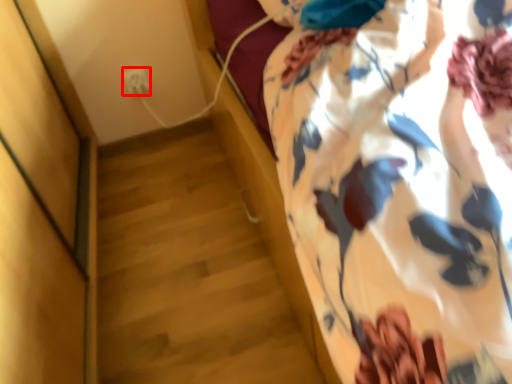
Question: From the image's perspective, what is the correct spatial positioning of electric outlet (annotated by the red box) in reference to curtain?

Choices:
 (A) above
 (B) below

Answer: (A)